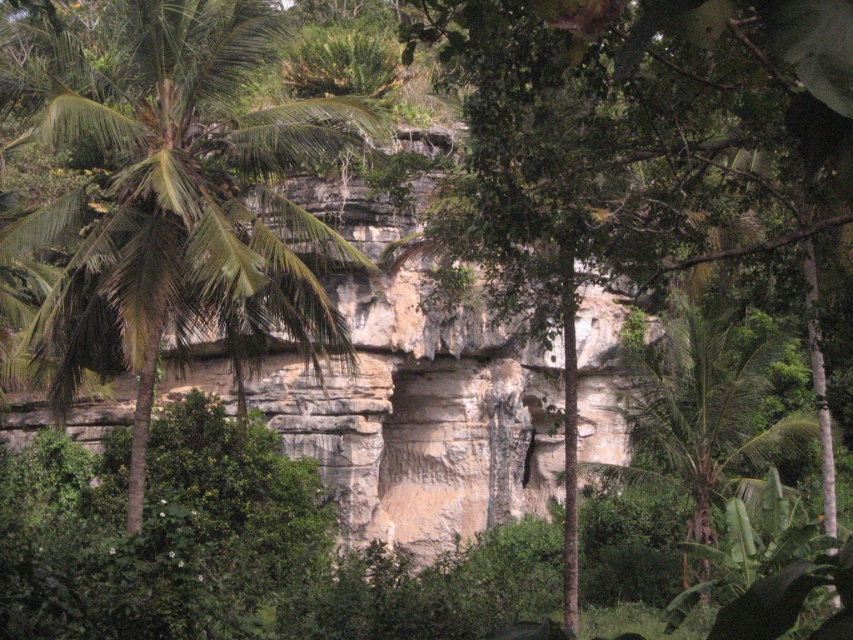
Question: Does green leafy palm tree at left have a lesser width compared to green leafy palm tree at center?

Choices:
 (A) no
 (B) yes

Answer: (A)

Question: Can you confirm if green leafy palm tree at left is positioned above green leafy palm tree at center?

Choices:
 (A) yes
 (B) no

Answer: (A)

Question: Among these objects, which one is farthest from the camera?

Choices:
 (A) green leafy palm tree at center
 (B) green leafy palm tree at left

Answer: (A)

Question: Is green leafy palm tree at left to the right of green leafy palm tree at center from the viewer's perspective?

Choices:
 (A) yes
 (B) no

Answer: (B)